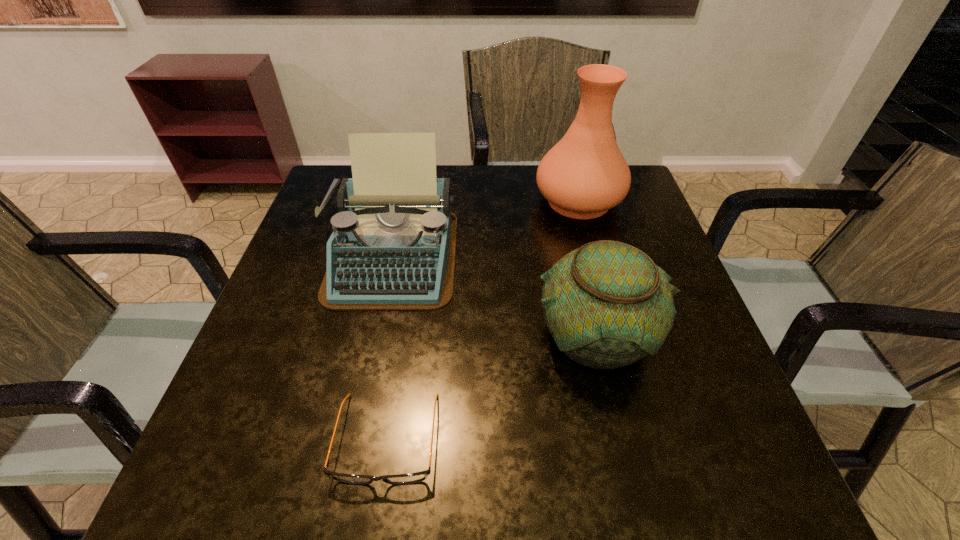
The width and height of the screenshot is (960, 540). I want to click on free area in between the vase and the nearest object, so click(483, 320).

Locate an element on the screen. The width and height of the screenshot is (960, 540). vacant area between the shortest object and the third tallest object is located at coordinates (491, 387).

Identify the location of vacant area that lies between the shortest object and the tallest object. (483, 320).

In order to click on vacant space in between the second shortest object and the nearest object in this screenshot , I will do `click(491, 387)`.

This screenshot has width=960, height=540. I want to click on vacant space that's between the spectacles and the tallest object, so click(483, 320).

What are the coordinates of `free space between the typewriter and the nearest object` in the screenshot? It's located at (390, 347).

Where is `free point between the spectacles and the pottery`? The height and width of the screenshot is (540, 960). free point between the spectacles and the pottery is located at coordinates (491, 387).

Where is `vacant region between the spectacles and the tallest object`? The width and height of the screenshot is (960, 540). vacant region between the spectacles and the tallest object is located at coordinates (483, 320).

Image resolution: width=960 pixels, height=540 pixels. Identify the location of object that stands as the third closest to the spectacles. (584, 175).

Select which object appears as the closest to the nearest object. Please provide its 2D coordinates. Your answer should be formatted as a tuple, i.e. [(x, y)], where the tuple contains the x and y coordinates of a point satisfying the conditions above.

[(606, 304)]